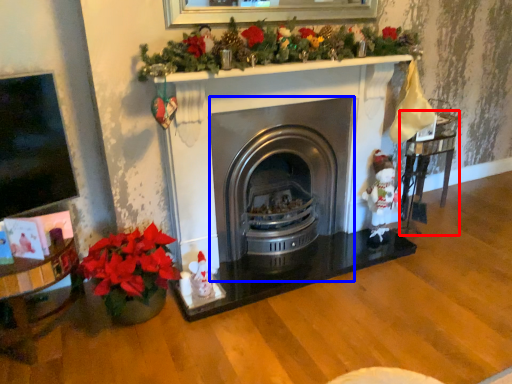
Question: Which object appears closest to the camera in this image, table (highlighted by a red box) or wood burning stove (highlighted by a blue box)?

Choices:
 (A) table
 (B) wood burning stove

Answer: (B)